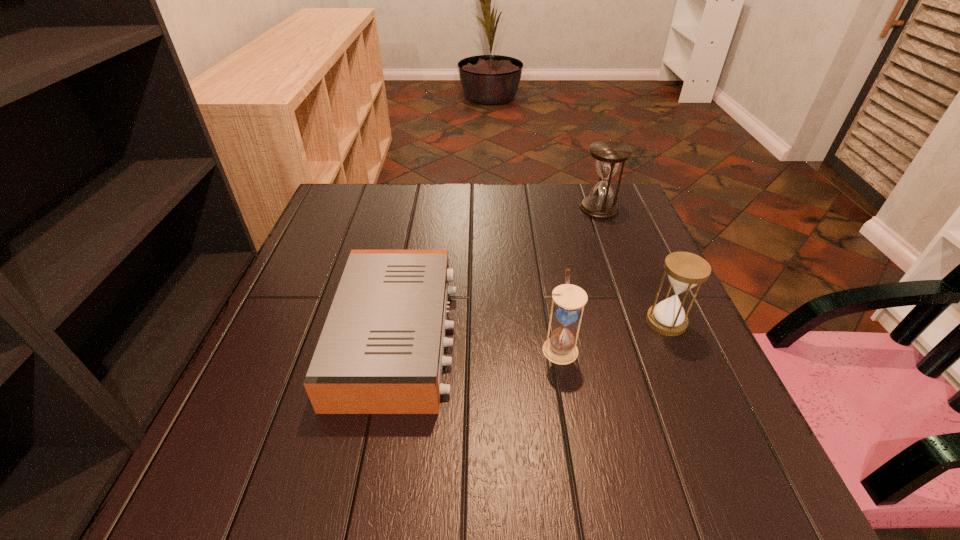
Image resolution: width=960 pixels, height=540 pixels. I want to click on object that stands as the third closest to the farthest object, so click(x=560, y=348).

Identify which hourglass is the nearest to the radio receiver. Please provide its 2D coordinates. Your answer should be formatted as a tuple, i.e. [(x, y)], where the tuple contains the x and y coordinates of a point satisfying the conditions above.

[(560, 348)]

Where is `hourglass that can be found as the closest to the leftmost hourglass`? hourglass that can be found as the closest to the leftmost hourglass is located at coordinates (685, 270).

Where is `free location that satisfies the following two spatial constraints: 1. on the back side of the leftmost hourglass; 2. on the control panel of the leftmost object`? The image size is (960, 540). free location that satisfies the following two spatial constraints: 1. on the back side of the leftmost hourglass; 2. on the control panel of the leftmost object is located at coordinates coord(558,336).

Where is `free space that satisfies the following two spatial constraints: 1. on the back side of the leftmost hourglass; 2. on the control panel of the leftmost object`? The height and width of the screenshot is (540, 960). free space that satisfies the following two spatial constraints: 1. on the back side of the leftmost hourglass; 2. on the control panel of the leftmost object is located at coordinates (558, 336).